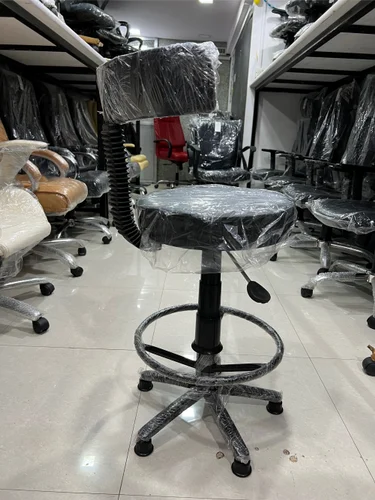
Locate an element on the screen. red chair is located at coordinates (172, 133).